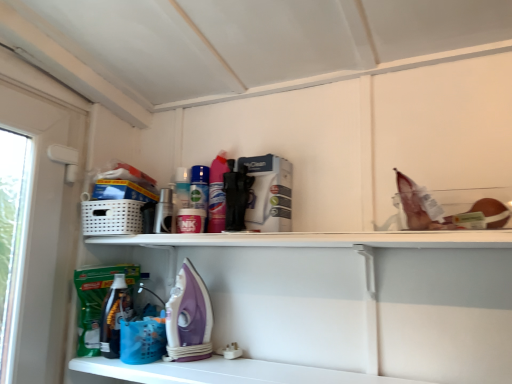
Locate an element on the screen. The image size is (512, 384). vacant space to the right of purple plastic iron at lower center is located at coordinates 229,364.